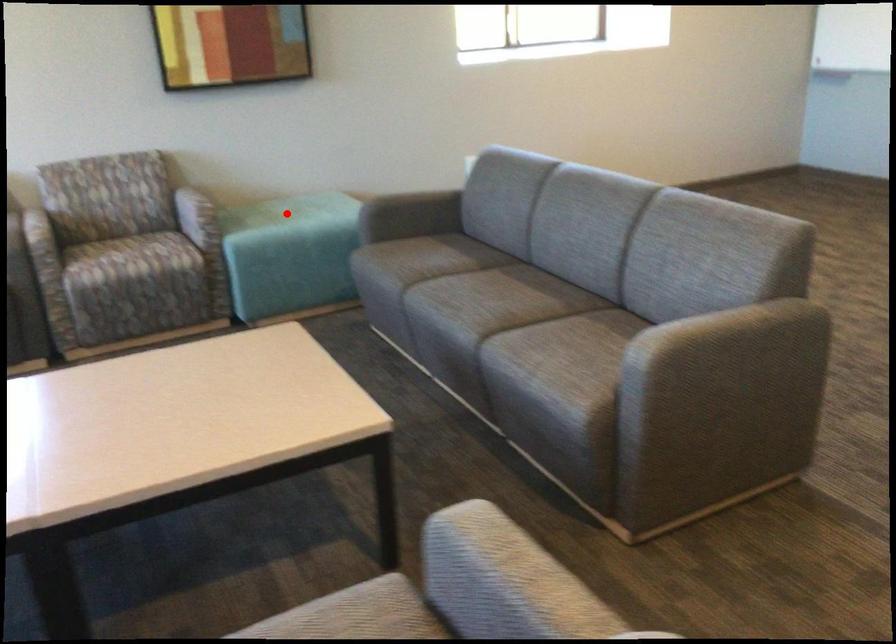
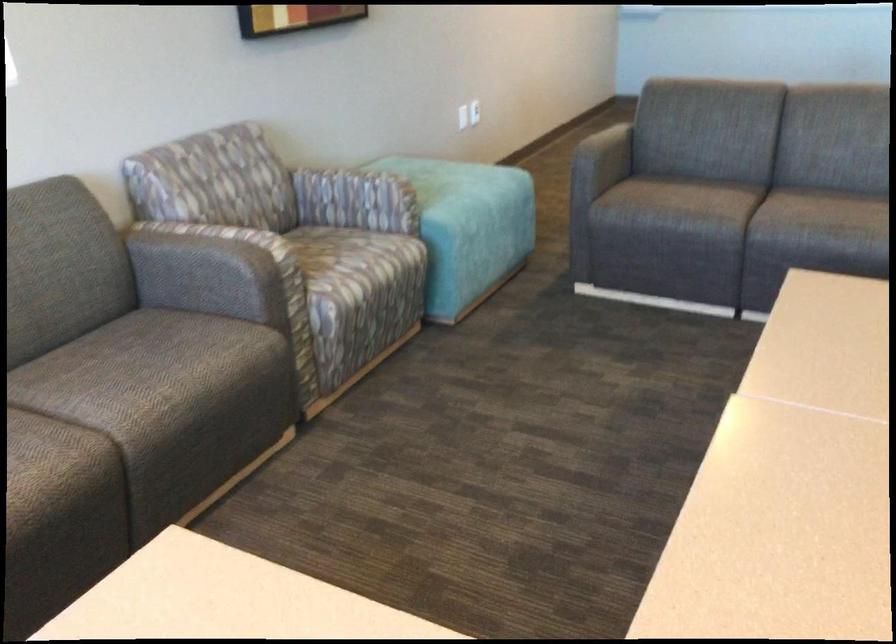
Question: I am providing you with two images of the same scene from different viewpoints. A red point is marked on the first image. Is the red point's position out of view in image 2?

Choices:
 (A) Yes
 (B) No

Answer: (A)